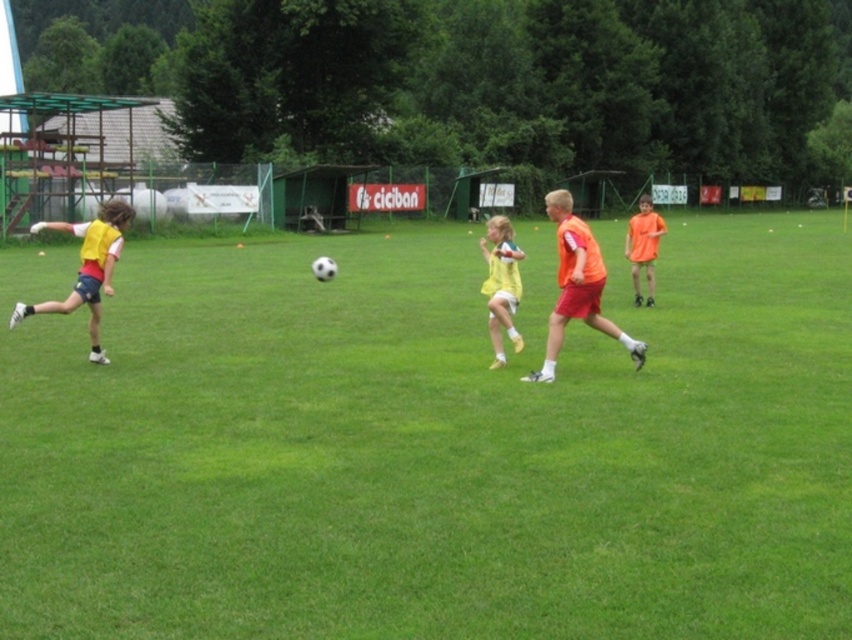
Question: Which object appears closest to the camera in this image?

Choices:
 (A) orange fabric shorts at center
 (B) yellow matte jersey at left

Answer: (A)

Question: Estimate the real-world distances between objects in this image. Which object is farther from the yellow matte jersey at left?

Choices:
 (A) green grass at center
 (B) orange fabric shorts at center
 (C) orange matte shirt at right
 (D) yellow matte jersey at center

Answer: (C)

Question: Which object appears closest to the camera in this image?

Choices:
 (A) yellow matte jersey at center
 (B) orange matte shirt at right
 (C) orange fabric shorts at center

Answer: (C)

Question: Observing the image, what is the correct spatial positioning of green grass at center in reference to orange fabric shorts at center?

Choices:
 (A) above
 (B) below

Answer: (A)

Question: Can you confirm if green grass at center is positioned above yellow matte jersey at center?

Choices:
 (A) no
 (B) yes

Answer: (A)

Question: Does green grass at center appear under yellow matte jersey at center?

Choices:
 (A) yes
 (B) no

Answer: (A)